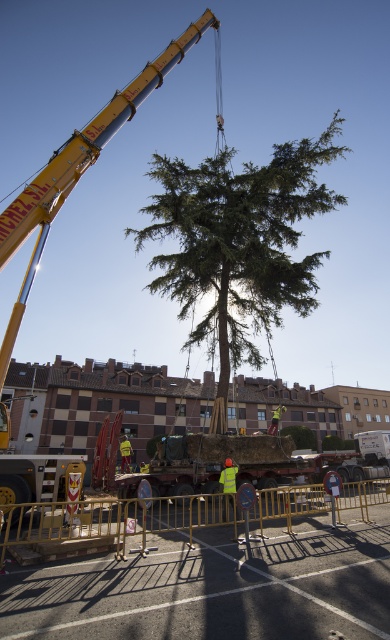
Question: Can you confirm if green textured tree at center is smaller than yellow reflective vest at center?

Choices:
 (A) yes
 (B) no

Answer: (B)

Question: Observing the image, what is the correct spatial positioning of gold metallic barricade at lower center in reference to yellow metallic crane at upper center?

Choices:
 (A) above
 (B) below

Answer: (B)

Question: Which point appears farthest from the camera in this image?

Choices:
 (A) (26, 193)
 (B) (154, 212)
 (C) (370, 497)
 (D) (221, 480)

Answer: (B)

Question: Can you confirm if yellow metallic crane at upper center is positioned to the left of yellow reflective vest at center?

Choices:
 (A) no
 (B) yes

Answer: (B)

Question: Which object appears farthest from the camera in this image?

Choices:
 (A) yellow reflective vest at center
 (B) green textured tree at center
 (C) gold metallic barricade at lower center
 (D) yellow metallic crane at upper center

Answer: (B)

Question: Which of these objects is positioned closest to the green textured tree at center?

Choices:
 (A) gold metallic barricade at lower center
 (B) yellow metallic crane at upper center
 (C) yellow reflective vest at center

Answer: (B)